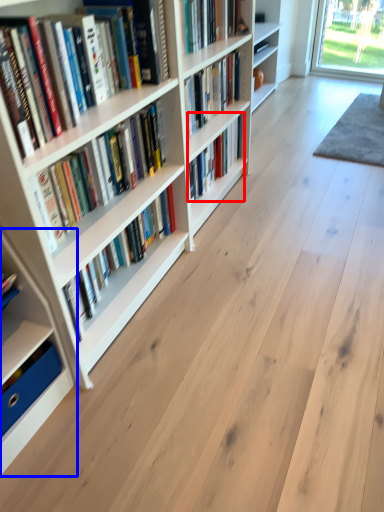
Question: Which point is further to the camera, book (highlighted by a red box) or shelf (highlighted by a blue box)?

Choices:
 (A) book
 (B) shelf

Answer: (A)